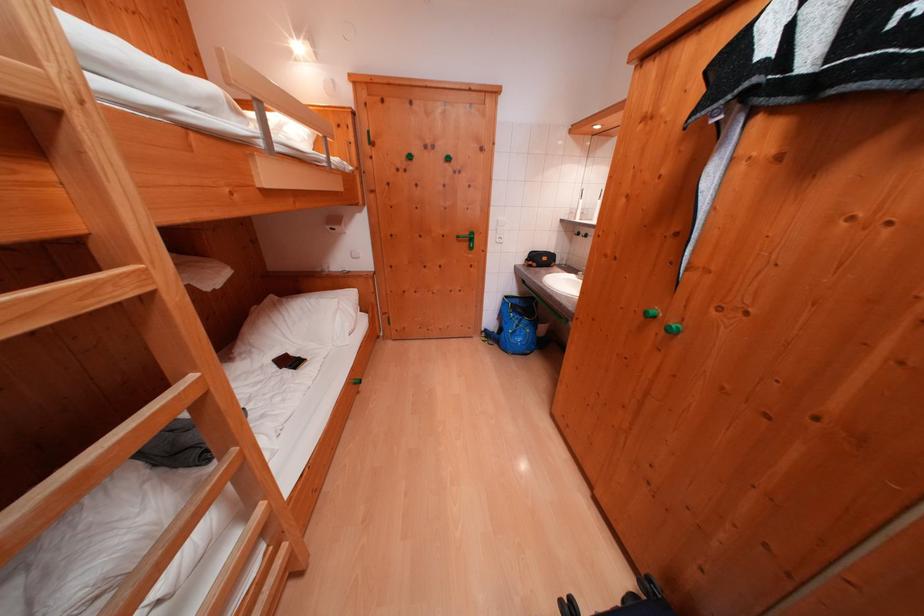
Image resolution: width=924 pixels, height=616 pixels. Describe the element at coordinates (287, 361) in the screenshot. I see `the black wallet` at that location.